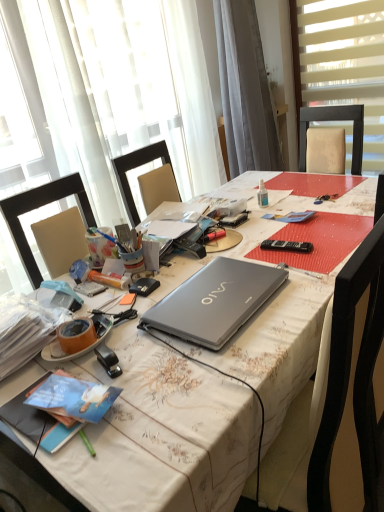
Locate an element on the screen. vacant area that lies in front of blue matte book at lower left, which ranks as the first book in bottom-to-top order is located at coordinates [70, 463].